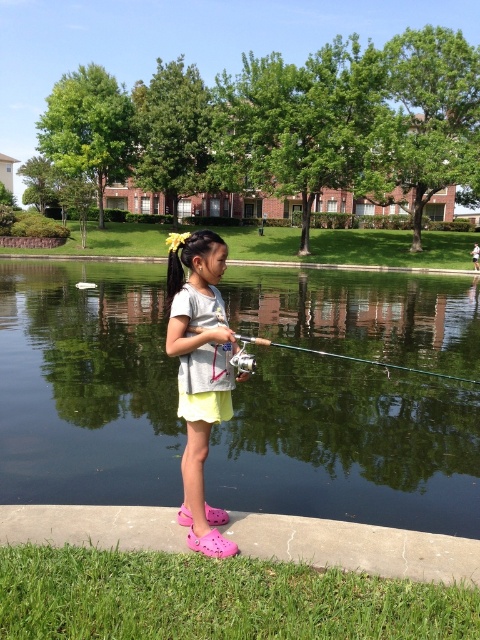
Is point (455, 445) in front of point (336, 355)?

Yes, it is.

This screenshot has height=640, width=480. Describe the element at coordinates (86, 387) in the screenshot. I see `green reflective water at center` at that location.

At what (x,y) coordinates should I click in order to perform the action: click on green reflective water at center. Please return your answer as a coordinate pair (x, y). The image size is (480, 640). Looking at the image, I should click on (86, 387).

Can you confirm if light gray cotton shirt at center is positioned above metallic silver fishing pole at center?

No.

Does point (181, 476) lie in front of point (259, 344)?

Yes, point (181, 476) is in front of point (259, 344).

This screenshot has width=480, height=640. I want to click on light gray cotton shirt at center, so click(200, 372).

Can you confirm if green reflective water at center is positioned to the left of light gray cotton shirt at center?

In fact, green reflective water at center is to the right of light gray cotton shirt at center.

Which is above, green reflective water at center or light gray cotton shirt at center?

Positioned higher is green reflective water at center.

Does point (418, 381) lie behind point (211, 337)?

Yes, it is.

Locate an element on the screen. The width and height of the screenshot is (480, 640). green reflective water at center is located at coordinates (86, 387).